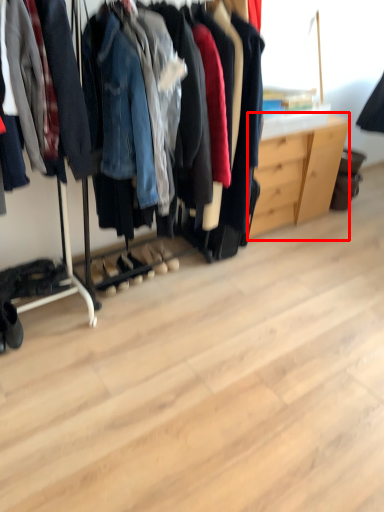
Question: From the image's perspective, where is dresser (annotated by the red box) located relative to footwear?

Choices:
 (A) below
 (B) above

Answer: (B)